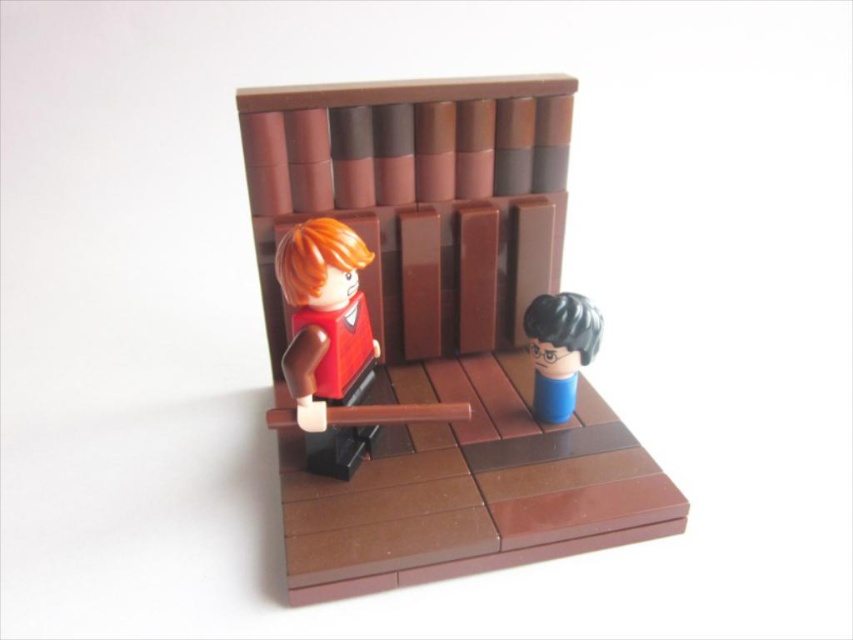
Can you confirm if matte orange hair at left is positioned above blue matte head at center?

Yes, matte orange hair at left is above blue matte head at center.

In the scene shown: Between matte orange hair at left and blue matte head at center, which one has less height?

blue matte head at center is shorter.

Does point (351, 280) come closer to viewer compared to point (546, 353)?

Yes.

Image resolution: width=853 pixels, height=640 pixels. In order to click on matte orange hair at left in this screenshot , I will do `click(326, 339)`.

Between point (351, 406) and point (579, 362), which one is positioned behind?

The point (579, 362) is more distant.

Which is in front, point (415, 412) or point (567, 346)?

Point (415, 412) is more forward.

Between point (531, 387) and point (558, 340), which one is positioned in front?

Point (558, 340) is more forward.

Locate an element on the screen. The width and height of the screenshot is (853, 640). smooth red shirt at center is located at coordinates (436, 333).

Does smooth red shirt at center appear over matte orange hair at left?

Indeed, smooth red shirt at center is positioned over matte orange hair at left.

This screenshot has height=640, width=853. Describe the element at coordinates (436, 333) in the screenshot. I see `smooth red shirt at center` at that location.

You are a GUI agent. You are given a task and a screenshot of the screen. Output one action in this format:
    pyautogui.click(x=<x>, y=<y>)
    Task: Click on the smooth red shirt at center
    The width and height of the screenshot is (853, 640).
    Given the screenshot: What is the action you would take?
    pyautogui.click(x=436, y=333)